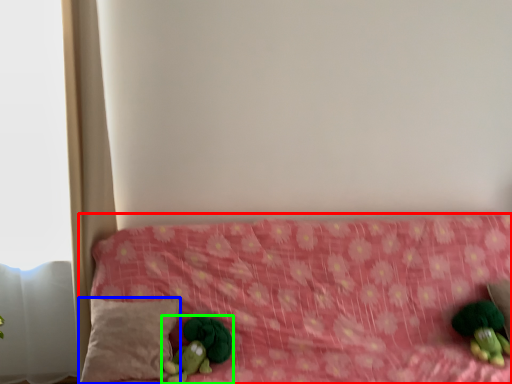
Question: Which object is the farthest from furniture (highlighted by a red box)? Choose among these: pillow (highlighted by a blue box) or toy (highlighted by a green box).

Choices:
 (A) pillow
 (B) toy

Answer: (B)